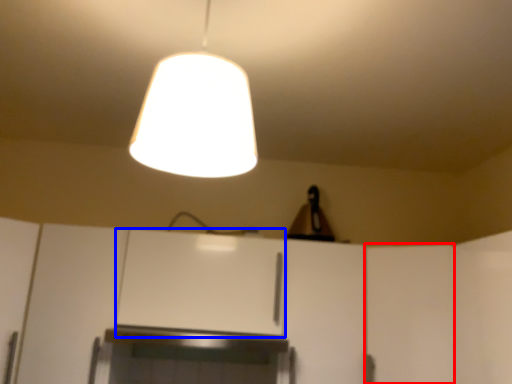
Question: Which point is closer to the camera, door (highlighted by a red box) or cabinetry (highlighted by a blue box)?

Choices:
 (A) door
 (B) cabinetry

Answer: (A)